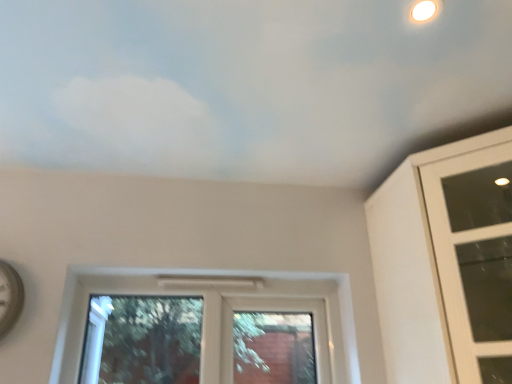
Question: From the image's perspective, is white glass window at upper right, acting as the second window starting from the left, above or below clear glass window at center, marked as the 2th window in a right-to-left arrangement?

Choices:
 (A) below
 (B) above

Answer: (B)

Question: Looking at the image, does white glass window at upper right, arranged as the first window when viewed from the right, seem bigger or smaller compared to clear glass window at center, marked as the 2th window in a right-to-left arrangement?

Choices:
 (A) small
 (B) big

Answer: (B)

Question: Estimate the real-world distances between objects in this image. Which object is closer to the white matte cloud at upper center?

Choices:
 (A) clear glass window at center, marked as the 2th window in a right-to-left arrangement
 (B) white glass window at upper right, arranged as the first window when viewed from the right

Answer: (B)

Question: Considering the real-world distances, which object is closest to the white matte cloud at upper center?

Choices:
 (A) clear glass window at center, the 1th window viewed from the left
 (B) white glass window at upper right, arranged as the first window when viewed from the right

Answer: (B)